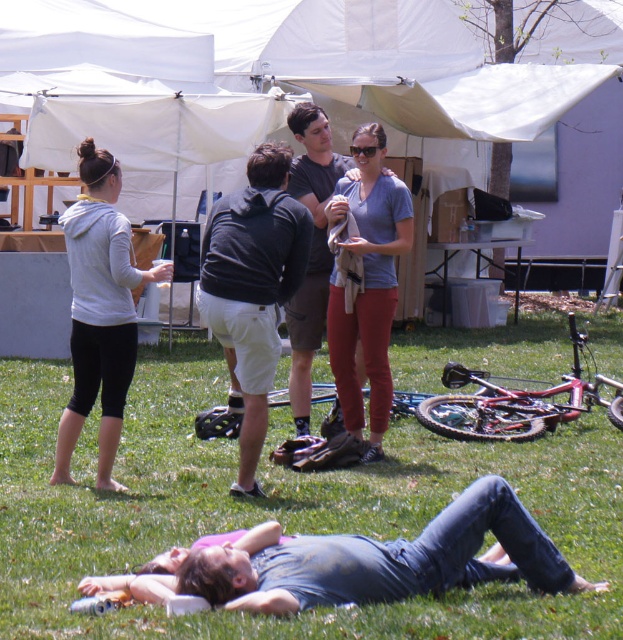
Between white fabric tent at upper center and metallic red bicycle at lower right, which one is positioned higher?

Positioned higher is white fabric tent at upper center.

The image size is (623, 640). What are the coordinates of `white fabric tent at upper center` in the screenshot? It's located at [x=257, y=74].

This screenshot has width=623, height=640. Find the location of `white fabric tent at upper center`. white fabric tent at upper center is located at coordinates (257, 74).

Which is more to the right, metallic red bicycle at lower right or clear plastic sunglasses at center?

metallic red bicycle at lower right

Between metallic red bicycle at lower right and clear plastic sunglasses at center, which one is positioned lower?

metallic red bicycle at lower right

Which is behind, point (546, 403) or point (358, 154)?

The point (546, 403) is behind.

In order to click on metallic red bicycle at lower right in this screenshot , I will do `click(515, 403)`.

Is white fabric tent at upper center wider than white matte hoodie at left?

Indeed, white fabric tent at upper center has a greater width compared to white matte hoodie at left.

Does white fabric tent at upper center appear over white matte hoodie at left?

Correct, white fabric tent at upper center is located above white matte hoodie at left.

Who is more distant from viewer, (40, 124) or (115, 365)?

Point (40, 124)

Image resolution: width=623 pixels, height=640 pixels. Identify the location of white fabric tent at upper center. (257, 74).